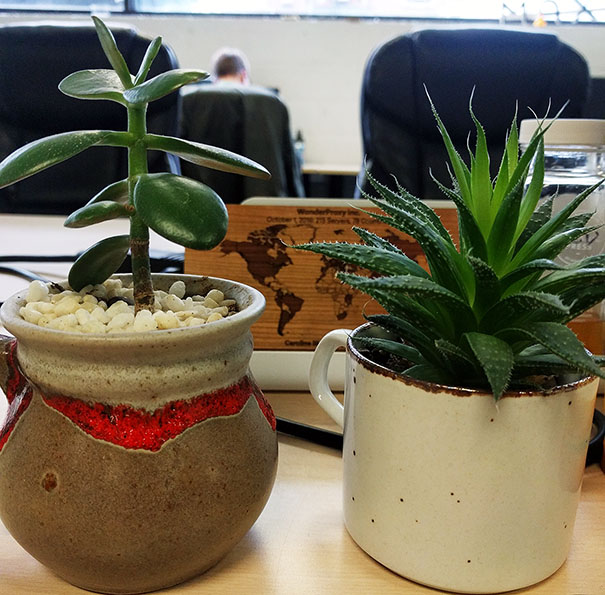
You are a GUI agent. You are given a task and a screenshot of the screen. Output one action in this format:
    pyautogui.click(x=<x>, y=<y>)
    Task: Click on the chair
    This screenshot has width=605, height=595.
    Given the screenshot: What is the action you would take?
    pyautogui.click(x=433, y=95), pyautogui.click(x=258, y=123), pyautogui.click(x=0, y=106)